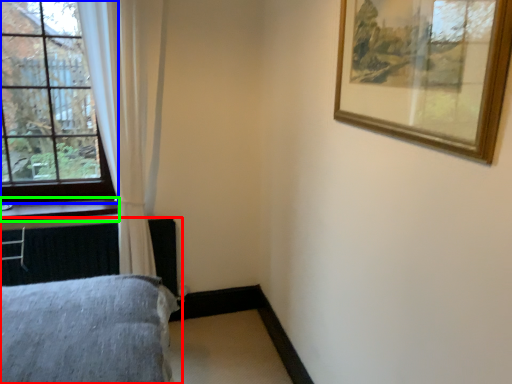
Question: Based on their relative distances, which object is nearer to bed (highlighted by a red box)? Choose from window (highlighted by a blue box) and window sill (highlighted by a green box).

Choices:
 (A) window
 (B) window sill

Answer: (B)